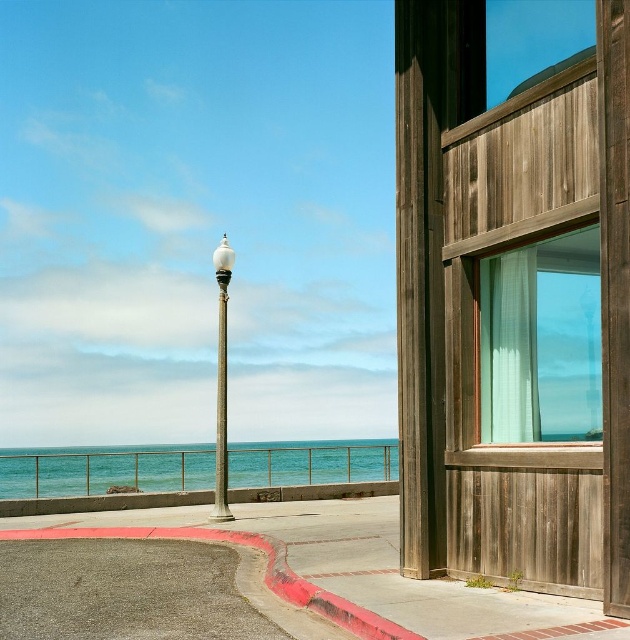
Question: Among these objects, which one is farthest from the camera?

Choices:
 (A) blue water at lower left
 (B) red painted concrete curb at lower left
 (C) translucent teal curtain at right
 (D) white glossy lamp post at center

Answer: (A)

Question: Does blue water at lower left appear on the right side of red painted concrete curb at lower left?

Choices:
 (A) yes
 (B) no

Answer: (B)

Question: Can you confirm if translucent teal curtain at right is smaller than white glossy lamp post at center?

Choices:
 (A) no
 (B) yes

Answer: (B)

Question: Which of the following is the farthest from the observer?

Choices:
 (A) translucent teal curtain at right
 (B) white glossy lamp post at center

Answer: (B)

Question: Which point is closer to the camera?

Choices:
 (A) translucent teal curtain at right
 (B) white glossy lamp post at center
 (C) blue water at lower left

Answer: (A)

Question: Does blue water at lower left have a smaller size compared to white glossy lamp post at center?

Choices:
 (A) no
 (B) yes

Answer: (A)